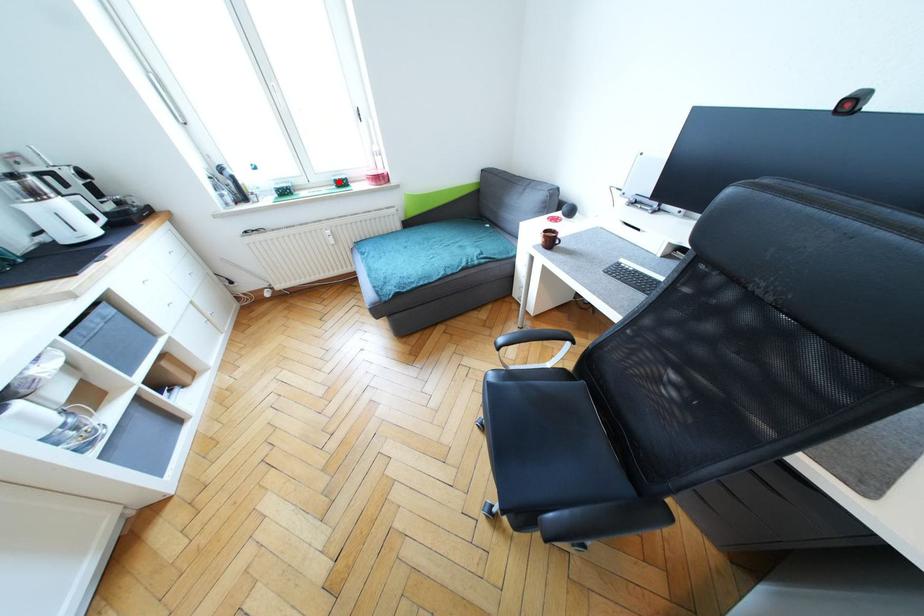
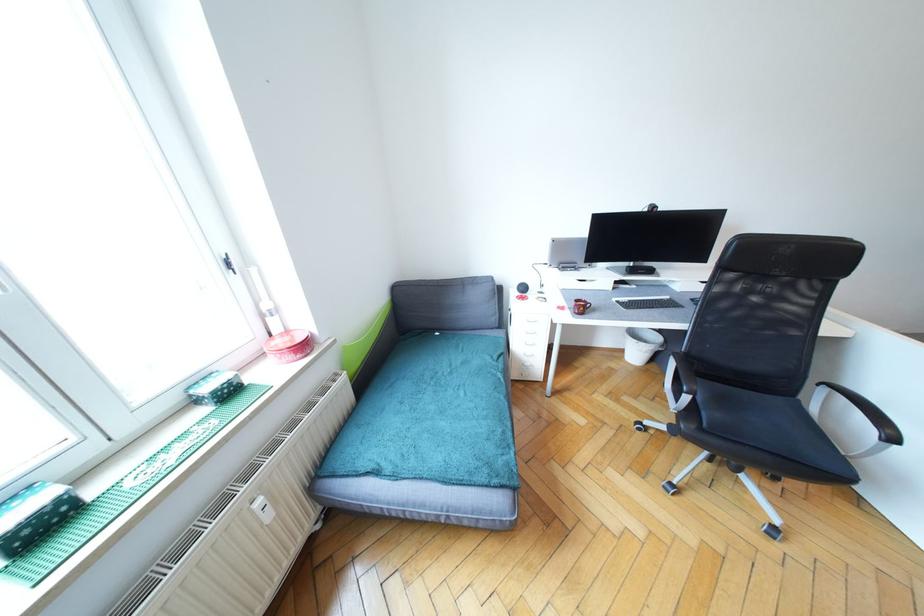
Question: I am providing you with two images of the same scene from different viewpoints. Image1 has a red point marked. In image2, the corresponding 3D location appears at what relative position? Reply with the corresponding letter.

Choices:
 (A) Closer
 (B) Farther

Answer: (B)